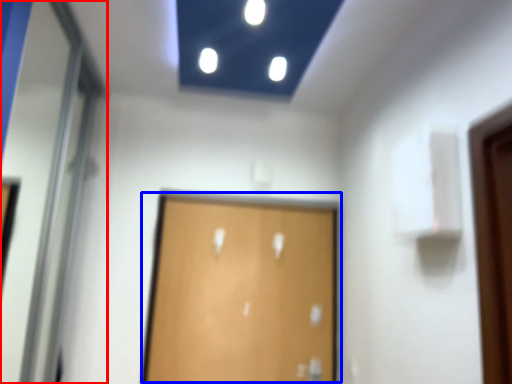
Question: Which object appears closest to the camera in this image, elevator door (highlighted by a red box) or door (highlighted by a blue box)?

Choices:
 (A) elevator door
 (B) door

Answer: (A)